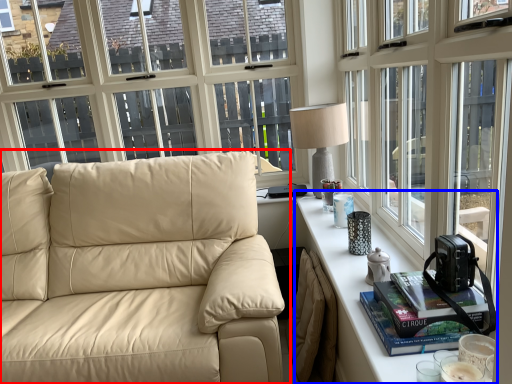
Question: Which of the following is the farthest to the observer, studio couch (highlighted by a red box) or table (highlighted by a blue box)?

Choices:
 (A) studio couch
 (B) table

Answer: (A)